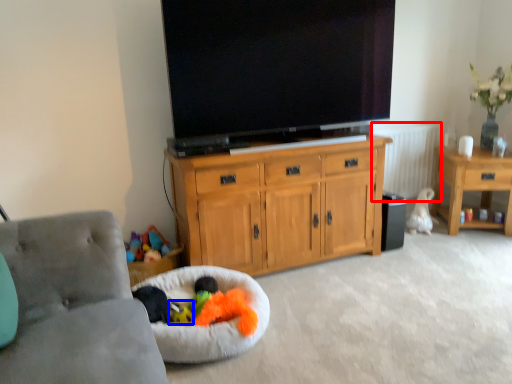
Question: Which point is further to the camera, radiator (highlighted by a red box) or toy (highlighted by a blue box)?

Choices:
 (A) radiator
 (B) toy

Answer: (A)